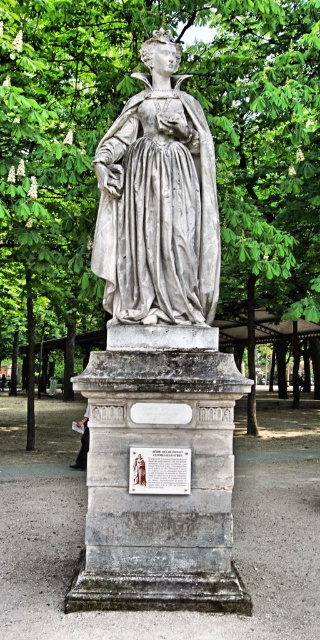
Question: Can you confirm if green leafy tree at upper center is positioned to the right of black leather jacket at lower left?

Choices:
 (A) no
 (B) yes

Answer: (B)

Question: Is green leafy tree at upper center to the left of gray marble statue at center from the viewer's perspective?

Choices:
 (A) yes
 (B) no

Answer: (A)

Question: Observing the image, what is the correct spatial positioning of white stone plaque at center in reference to black leather jacket at lower left?

Choices:
 (A) left
 (B) right

Answer: (B)

Question: Which point is farther from the camera taking this photo?

Choices:
 (A) (81, 419)
 (B) (208, 273)
 (C) (109, 285)

Answer: (A)

Question: Which object is positioned closest to the black leather jacket at lower left?

Choices:
 (A) green leafy tree at upper center
 (B) gray marble statue at center
 (C) white stone plaque at center

Answer: (A)

Question: Which object appears closest to the camera in this image?

Choices:
 (A) white stone plaque at center
 (B) white marble statue at center

Answer: (B)